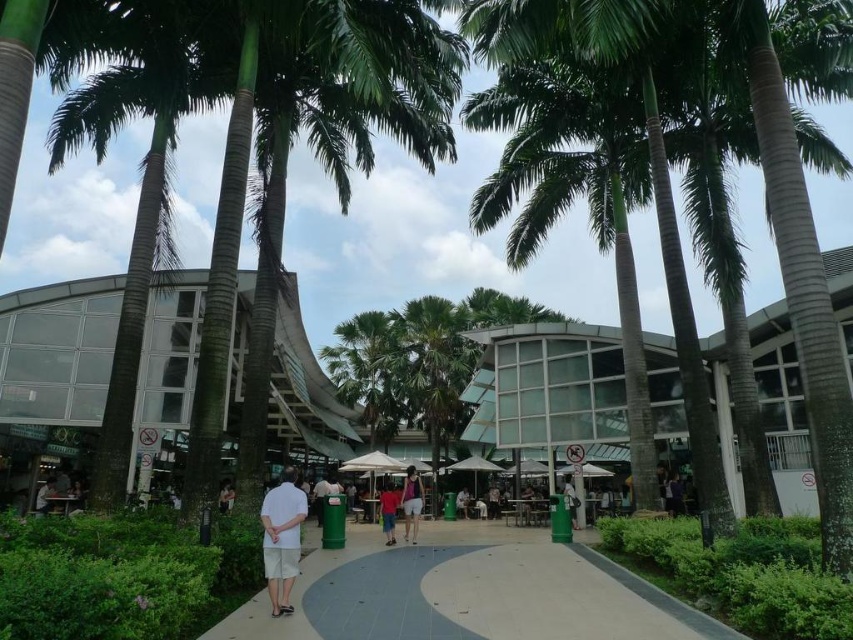
You are standing at the park and see two shirts hanging on a rack between the palm trees at the center. The shirts are the white cotton shirt at center and the bright orange shirt at center. Which shirt is shorter in height?

The white cotton shirt at center is shorter in height compared to the bright orange shirt at center.

You are standing on the paved pathway in the park and see both the white cotton shirt at center and the bright orange shirt at center. Which shirt is closer to you?

The white cotton shirt at center is closer to you because it is in front of the bright orange shirt at center.

You are standing on the gray concrete pavement at center and want to place a small potted plant on the matte pink shorts at center. Considering their sizes, will the plant fit without overlapping the edges?

The gray concrete pavement at center occupies less space than matte pink shorts at center, so the small potted plant will fit on the matte pink shorts at center without overlapping the edges.